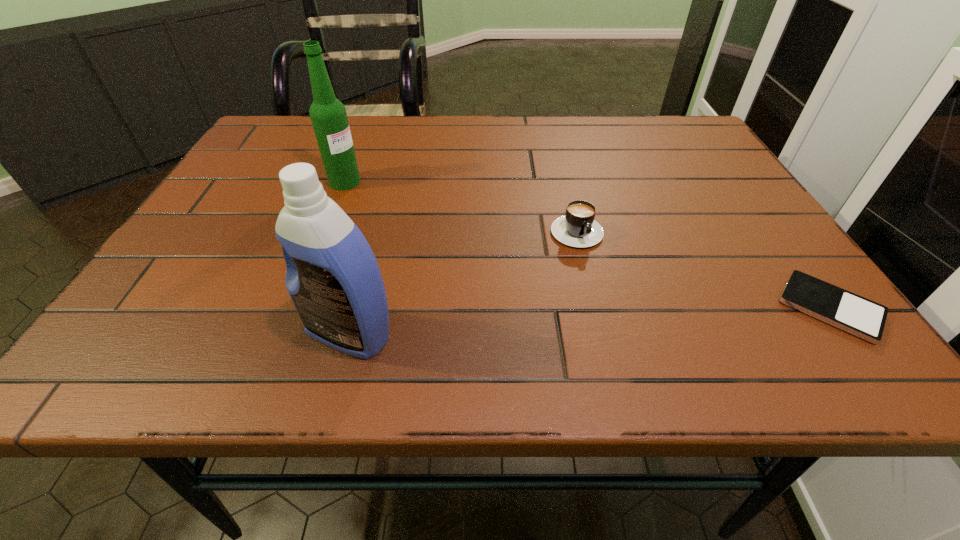
At what (x,y) coordinates should I click in order to perform the action: click on free space that satisfies the following two spatial constraints: 1. on the front side of the rightmost object; 2. on the right side of the farthest object. Please return your answer as a coordinate pair (x, y). Looking at the image, I should click on (296, 308).

Locate an element on the screen. Image resolution: width=960 pixels, height=540 pixels. vacant point that satisfies the following two spatial constraints: 1. on the front side of the beer bottle; 2. on the right side of the cappuccino is located at coordinates (328, 226).